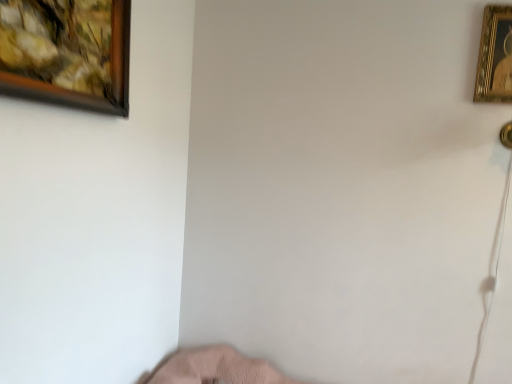
Question: From a real-world perspective, is gold metallic picture frame at upper right, the second picture frame in the front-to-back sequence, located beneath wooden framed painting at upper left, positioned as the 2th picture frame in back-to-front order?

Choices:
 (A) no
 (B) yes

Answer: (A)

Question: Does gold metallic picture frame at upper right, the second picture frame in the front-to-back sequence, have a larger size compared to wooden framed painting at upper left, which ranks as the second picture frame in right-to-left order?

Choices:
 (A) yes
 (B) no

Answer: (B)

Question: Is gold metallic picture frame at upper right, which is the 1th picture frame in back-to-front order, in contact with wooden framed painting at upper left, which is the first picture frame in left-to-right order?

Choices:
 (A) yes
 (B) no

Answer: (B)

Question: Is gold metallic picture frame at upper right, the second picture frame in the front-to-back sequence, wider than wooden framed painting at upper left, which is the 1th picture frame in front-to-back order?

Choices:
 (A) yes
 (B) no

Answer: (B)

Question: From the image's perspective, would you say gold metallic picture frame at upper right, which is the 1th picture frame in back-to-front order, is positioned over wooden framed painting at upper left, which ranks as the second picture frame in right-to-left order?

Choices:
 (A) yes
 (B) no

Answer: (A)

Question: Is wooden framed painting at upper left, which is the first picture frame in left-to-right order, at the back of gold metallic picture frame at upper right, which is the 1th picture frame in back-to-front order?

Choices:
 (A) no
 (B) yes

Answer: (A)

Question: Does wooden framed painting at upper left, which ranks as the second picture frame in right-to-left order, lie behind gold metallic picture frame at upper right, which is counted as the second picture frame, starting from the left?

Choices:
 (A) no
 (B) yes

Answer: (A)

Question: Is wooden framed painting at upper left, which is the first picture frame in left-to-right order, thinner than gold metallic picture frame at upper right, the second picture frame in the front-to-back sequence?

Choices:
 (A) no
 (B) yes

Answer: (A)

Question: Is gold metallic picture frame at upper right, which is the 1th picture frame in back-to-front order, surrounded by wooden framed painting at upper left, which is the 1th picture frame in front-to-back order?

Choices:
 (A) no
 (B) yes

Answer: (A)

Question: Considering the relative sizes of wooden framed painting at upper left, which is the first picture frame in left-to-right order, and gold metallic picture frame at upper right, marked as the first picture frame in a right-to-left arrangement, in the image provided, is wooden framed painting at upper left, which is the first picture frame in left-to-right order, bigger than gold metallic picture frame at upper right, marked as the first picture frame in a right-to-left arrangement,?

Choices:
 (A) no
 (B) yes

Answer: (B)

Question: Is wooden framed painting at upper left, which is the first picture frame in left-to-right order, in contact with gold metallic picture frame at upper right, marked as the first picture frame in a right-to-left arrangement?

Choices:
 (A) yes
 (B) no

Answer: (B)

Question: From the image's perspective, is wooden framed painting at upper left, which ranks as the second picture frame in right-to-left order, on top of gold metallic picture frame at upper right, the second picture frame in the front-to-back sequence?

Choices:
 (A) no
 (B) yes

Answer: (A)

Question: In terms of size, does gold metallic picture frame at upper right, marked as the first picture frame in a right-to-left arrangement, appear bigger or smaller than wooden framed painting at upper left, which is the 1th picture frame in front-to-back order?

Choices:
 (A) big
 (B) small

Answer: (B)